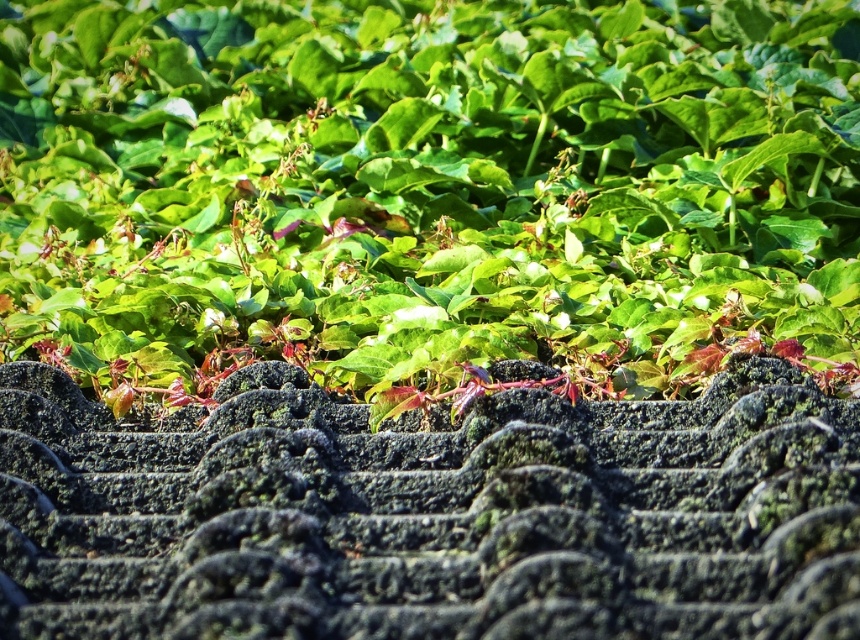
Question: Which point is farther to the camera?

Choices:
 (A) (783, 515)
 (B) (72, 20)

Answer: (B)

Question: Does green leafy plant at upper center have a smaller size compared to green mossy roof tiles at upper center?

Choices:
 (A) yes
 (B) no

Answer: (B)

Question: Is green leafy plant at upper center thinner than green mossy roof tiles at upper center?

Choices:
 (A) yes
 (B) no

Answer: (B)

Question: Does green leafy plant at upper center appear on the left side of green mossy roof tiles at upper center?

Choices:
 (A) no
 (B) yes

Answer: (B)